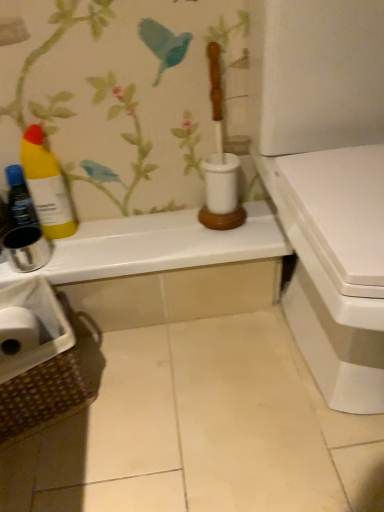
The width and height of the screenshot is (384, 512). In order to click on spots to the right of metallic silver bottle at left, the 1th bottle in the left-to-right sequence in this screenshot , I will do `click(107, 237)`.